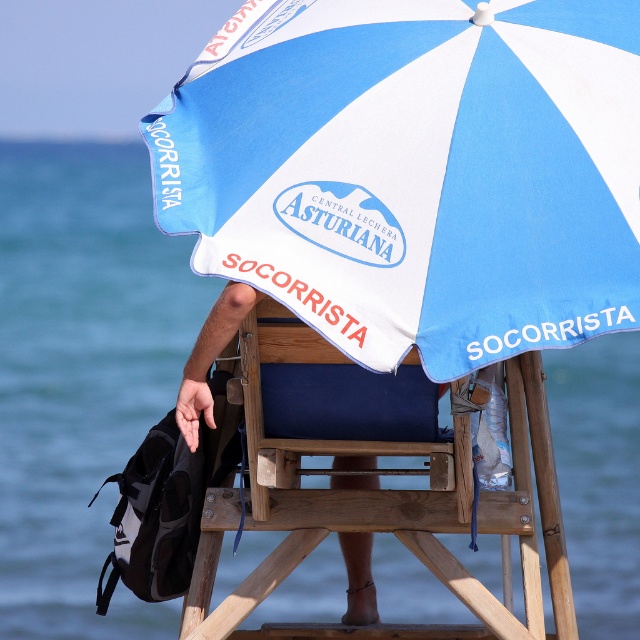
Locate an element on the screen. The height and width of the screenshot is (640, 640). blue fabric umbrella at center is located at coordinates (413, 170).

Locate an element on the screen. blue fabric umbrella at center is located at coordinates (413, 170).